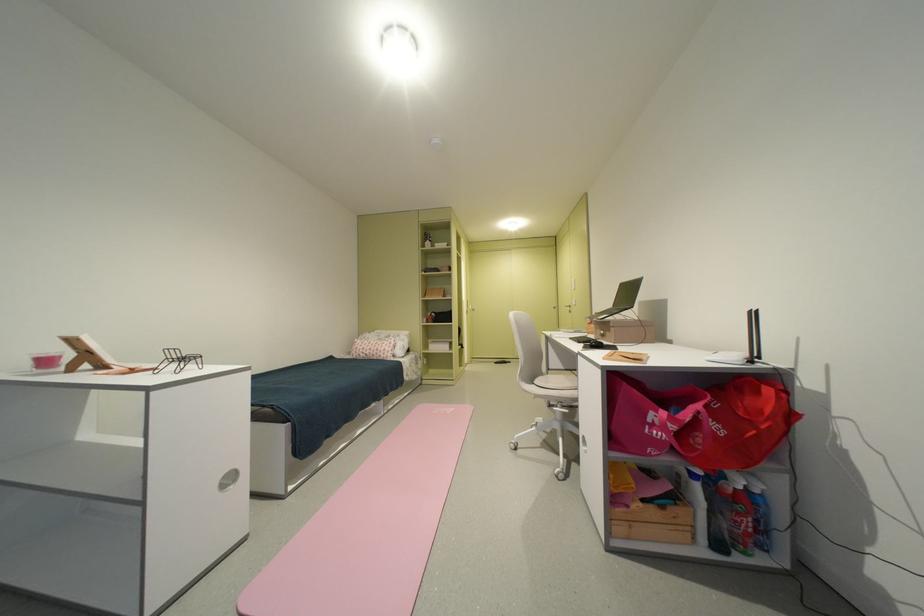
Identify the location of spray bottle trigger. The height and width of the screenshot is (616, 924). (748, 514).